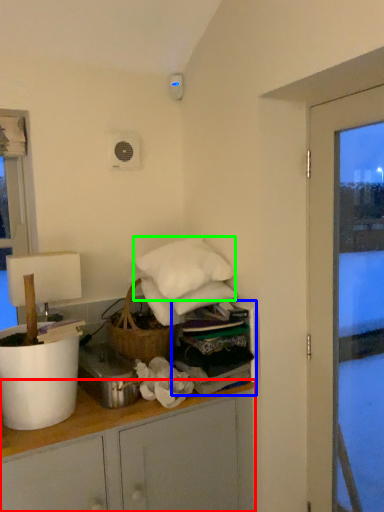
Question: Which object is the farthest from cabinetry (highlighted by a red box)? Choose among these: shelf (highlighted by a blue box) or pillow (highlighted by a green box).

Choices:
 (A) shelf
 (B) pillow

Answer: (B)